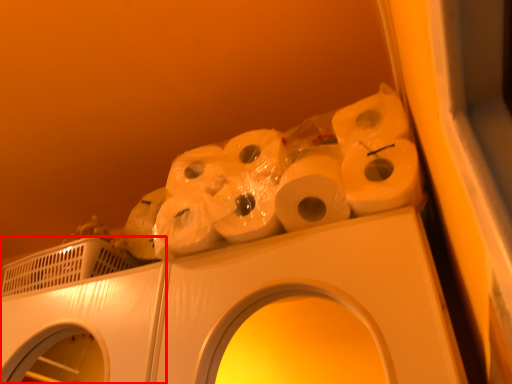
Question: Observing the image, what is the correct spatial positioning of washing machine (annotated by the red box) in reference to toilet paper?

Choices:
 (A) left
 (B) right

Answer: (A)